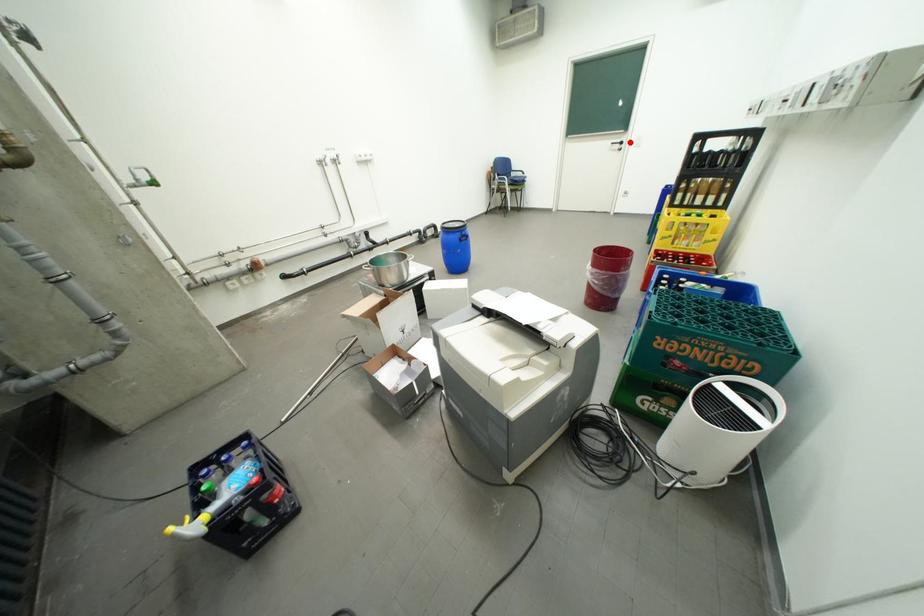
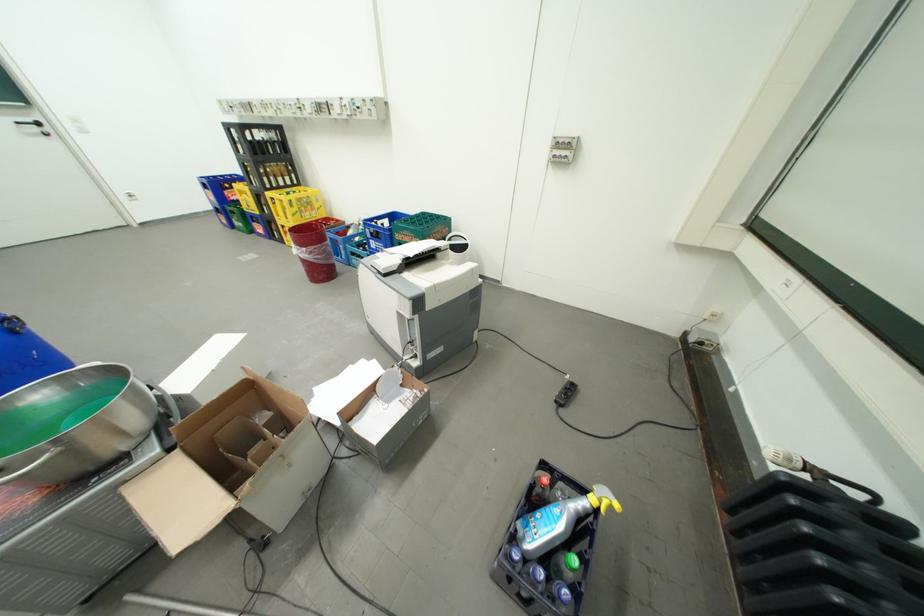
Question: I am providing you with two images of the same scene from different viewpoints. Given a red point in image1, look at the same physical point in image2. Is it:

Choices:
 (A) Closer to the viewpoint
 (B) Farther from the viewpoint

Answer: (B)